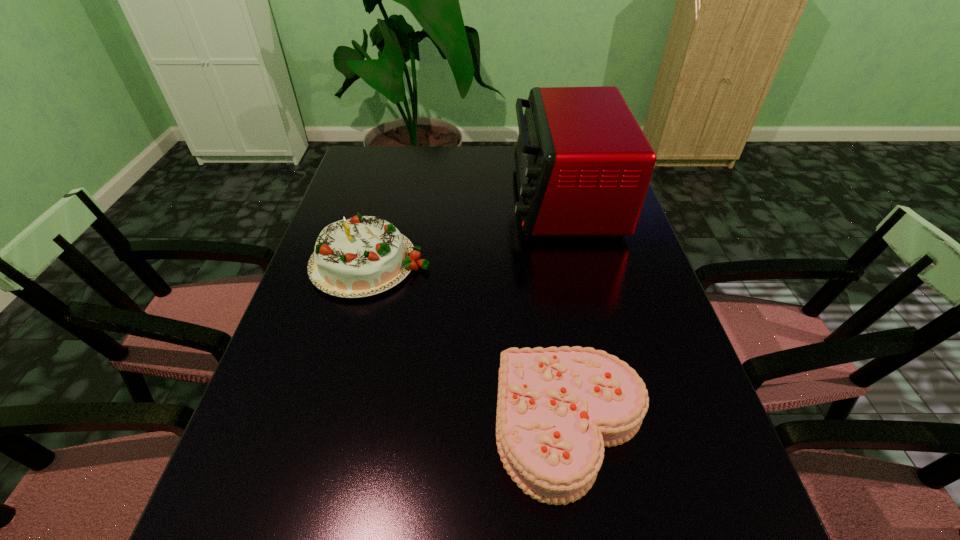
Where is `object that is the second closest one to the tallest object`? This screenshot has width=960, height=540. object that is the second closest one to the tallest object is located at coordinates (557, 408).

Select which object appears as the second closest to the leftmost object. Please provide its 2D coordinates. Your answer should be formatted as a tuple, i.e. [(x, y)], where the tuple contains the x and y coordinates of a point satisfying the conditions above.

[(557, 408)]

Find the location of a particular element. vacant area that satisfies the following two spatial constraints: 1. on the front-facing side of the toaster oven; 2. on the front side of the nearest object is located at coordinates (617, 427).

What are the coordinates of `free space that satisfies the following two spatial constraints: 1. on the front side of the left cake; 2. on the right side of the shorter cake` in the screenshot? It's located at (327, 427).